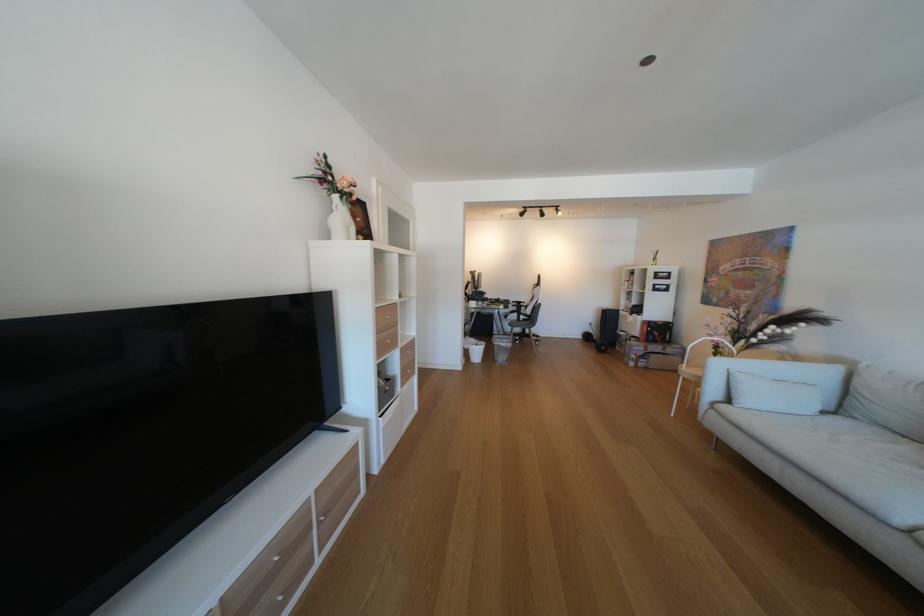
What do you see at coordinates (869, 459) in the screenshot?
I see `the sofa sitting surface` at bounding box center [869, 459].